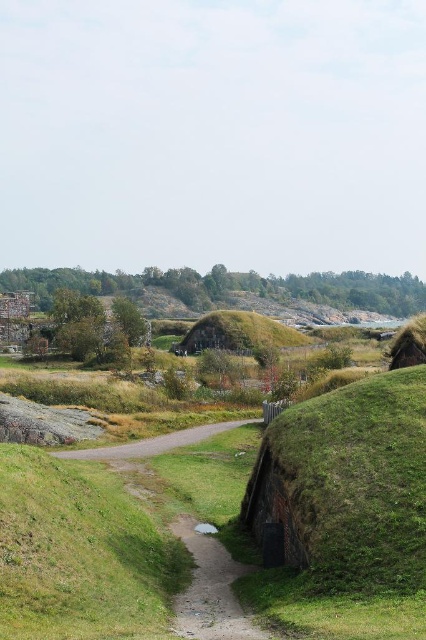
Question: Which point is closer to the camera taking this photo?

Choices:
 (A) (104, 461)
 (B) (218, 580)
 (C) (238, 340)

Answer: (B)

Question: From the image, what is the correct spatial relationship of dirt/gravel path at center in relation to green grassy mound at center?

Choices:
 (A) right
 (B) left

Answer: (B)

Question: Which of the following is the farthest from the observer?

Choices:
 (A) (218, 627)
 (B) (216, 326)

Answer: (B)

Question: Does green grassy mound at center appear under gravel road at center?

Choices:
 (A) yes
 (B) no

Answer: (B)

Question: Among these points, which one is farthest from the camera?

Choices:
 (A) (209, 627)
 (B) (132, 445)
 (C) (242, 324)

Answer: (C)

Question: Can you confirm if green grassy mound at center is positioned to the left of gravel road at center?

Choices:
 (A) yes
 (B) no

Answer: (B)